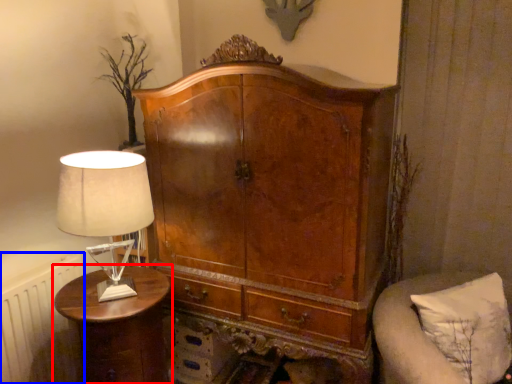
Question: Which point is further to the camera, nightstand (highlighted by a red box) or radiator (highlighted by a blue box)?

Choices:
 (A) nightstand
 (B) radiator

Answer: (B)